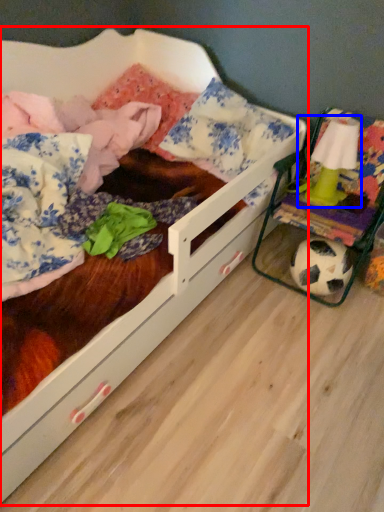
Question: Which of the following is the closest to the observer, infant bed (highlighted by a red box) or toy (highlighted by a blue box)?

Choices:
 (A) infant bed
 (B) toy

Answer: (A)